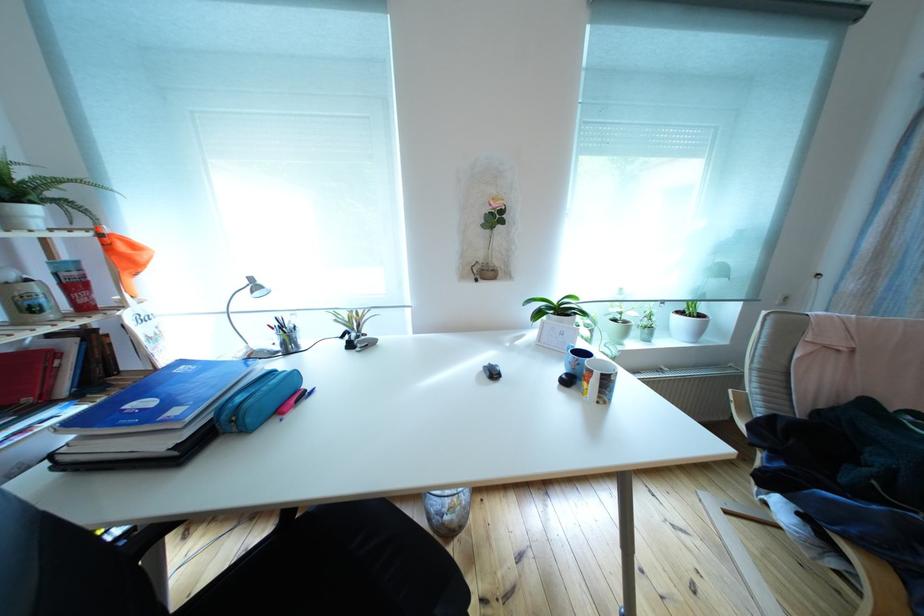
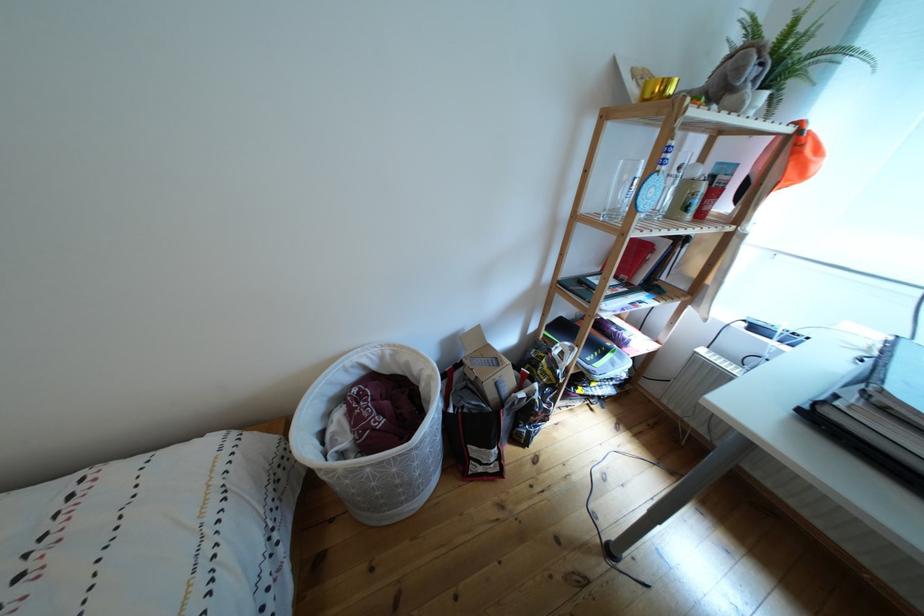
In the second image, find the point that corresponds to point (112, 241) in the first image.

(811, 138)